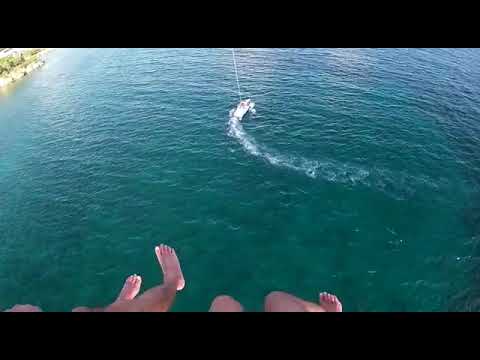
Locate an element on the screen. cable is located at coordinates (235, 66).